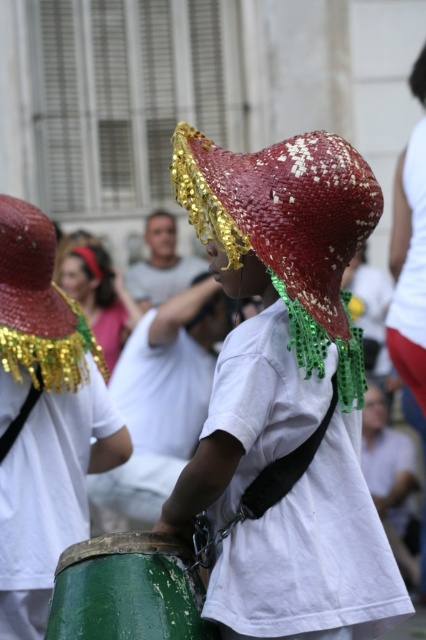
Question: Which point is farther to the camera?

Choices:
 (A) (253, 552)
 (B) (46, 234)
 (C) (112, 548)

Answer: (B)

Question: Does green weathered wood drum at lower center have a larger size compared to red straw hat at left?

Choices:
 (A) yes
 (B) no

Answer: (B)

Question: Which point appears closest to the camera in this image?

Choices:
 (A) (20, 237)
 (B) (307, 248)

Answer: (B)

Question: Is red straw hat at center above red straw hat at left?

Choices:
 (A) yes
 (B) no

Answer: (A)

Question: Is red straw hat at center wider than red straw hat at left?

Choices:
 (A) yes
 (B) no

Answer: (A)

Question: Which point is closer to the camera taking this photo?

Choices:
 (A) (63, 577)
 (B) (0, 236)
 (C) (293, 195)

Answer: (A)